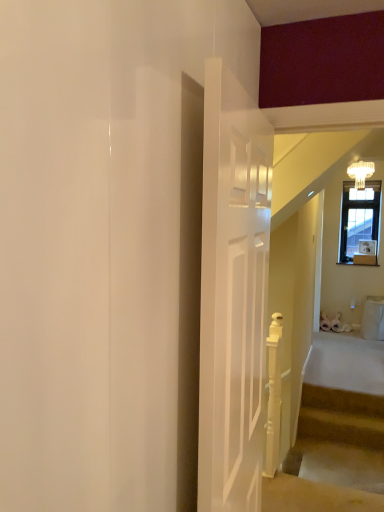
Question: Can you confirm if white glass chandelier at upper right is thinner than carpeted stairs at lower right?

Choices:
 (A) yes
 (B) no

Answer: (B)

Question: Is white glass chandelier at upper right completely or partially outside of carpeted stairs at lower right?

Choices:
 (A) yes
 (B) no

Answer: (A)

Question: From the image's perspective, would you say white glass chandelier at upper right is shown under carpeted stairs at lower right?

Choices:
 (A) yes
 (B) no

Answer: (B)

Question: Does white glass chandelier at upper right have a smaller size compared to carpeted stairs at lower right?

Choices:
 (A) no
 (B) yes

Answer: (B)

Question: Does white glass chandelier at upper right have a lesser height compared to carpeted stairs at lower right?

Choices:
 (A) yes
 (B) no

Answer: (B)

Question: Is white glass chandelier at upper right behind carpeted stairs at lower right?

Choices:
 (A) no
 (B) yes

Answer: (B)

Question: Is carpeted stairs at lower right to the right of white glass chandelier at upper right from the viewer's perspective?

Choices:
 (A) no
 (B) yes

Answer: (A)

Question: Is the depth of carpeted stairs at lower right greater than that of white glass chandelier at upper right?

Choices:
 (A) yes
 (B) no

Answer: (B)

Question: Are carpeted stairs at lower right and white glass chandelier at upper right beside each other?

Choices:
 (A) yes
 (B) no

Answer: (B)

Question: From a real-world perspective, is carpeted stairs at lower right on top of white glass chandelier at upper right?

Choices:
 (A) no
 (B) yes

Answer: (A)

Question: Considering the relative sizes of carpeted stairs at lower right and white glass chandelier at upper right in the image provided, is carpeted stairs at lower right wider than white glass chandelier at upper right?

Choices:
 (A) no
 (B) yes

Answer: (A)

Question: From a real-world perspective, is carpeted stairs at lower right physically below white glass chandelier at upper right?

Choices:
 (A) no
 (B) yes

Answer: (B)

Question: Would you say white glass chandelier at upper right is inside or outside carpeted stairs at lower right?

Choices:
 (A) outside
 (B) inside

Answer: (A)